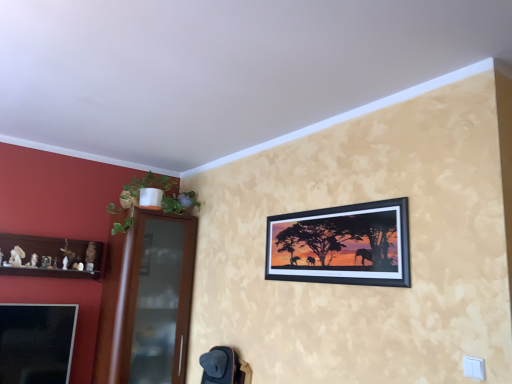
What do you see at coordinates (161, 194) in the screenshot? The width and height of the screenshot is (512, 384). I see `green leafy plant at left` at bounding box center [161, 194].

Where is `wooden shelf at left`? The width and height of the screenshot is (512, 384). wooden shelf at left is located at coordinates (50, 256).

Measure the distance between black matte picture frame at upper center and camera.

The depth of black matte picture frame at upper center is 6.35 feet.

Locate an element on the screen. green leafy plant at left is located at coordinates (161, 194).

Does green leafy plant at left have a lesser width compared to brown glass door at left?

Correct, the width of green leafy plant at left is less than that of brown glass door at left.

Considering the positions of objects green leafy plant at left and brown glass door at left in the image provided, who is more to the left, green leafy plant at left or brown glass door at left?

brown glass door at left.

In terms of size, does green leafy plant at left appear bigger or smaller than brown glass door at left?

green leafy plant at left is smaller than brown glass door at left.

Which is in front, point (168, 207) or point (178, 276)?

Point (168, 207)

Who is bigger, wooden shelf at left or black matte picture frame at upper center?

wooden shelf at left.

Considering the positions of objects wooden shelf at left and black matte picture frame at upper center in the image provided, who is in front, wooden shelf at left or black matte picture frame at upper center?

black matte picture frame at upper center is closer to the camera.

Does wooden shelf at left turn towards black matte picture frame at upper center?

Yes, wooden shelf at left faces towards black matte picture frame at upper center.

Does brown glass door at left turn towards wooden shelf at left?

No, brown glass door at left is not facing towards wooden shelf at left.

Which object is thinner, brown glass door at left or wooden shelf at left?

With smaller width is wooden shelf at left.

Can we say brown glass door at left lies outside wooden shelf at left?

brown glass door at left lies outside wooden shelf at left's area.

Where is `picture frame in front of the wooden shelf at left`? This screenshot has height=384, width=512. picture frame in front of the wooden shelf at left is located at coordinates (x=342, y=245).

Is black matte picture frame at upper center at the left side of wooden shelf at left?

In fact, black matte picture frame at upper center is to the right of wooden shelf at left.

Would you consider black matte picture frame at upper center to be distant from wooden shelf at left?

Indeed, black matte picture frame at upper center is not near wooden shelf at left.

Is black matte picture frame at upper center turned away from wooden shelf at left?

No, wooden shelf at left is not at the back of black matte picture frame at upper center.

Which of these two, brown glass door at left or black matte picture frame at upper center, stands shorter?

Standing shorter between the two is black matte picture frame at upper center.

Does point (151, 322) appear closer or farther from the camera than point (396, 279)?

Point (151, 322) is positioned farther from the camera compared to point (396, 279).

Is brown glass door at left next to black matte picture frame at upper center and touching it?

They are not placed beside each other.

Is brown glass door at left aimed at black matte picture frame at upper center?

Yes.

In the scene shown: Considering the sizes of objects black matte picture frame at upper center and green leafy plant at left in the image provided, who is smaller, black matte picture frame at upper center or green leafy plant at left?

Smaller between the two is black matte picture frame at upper center.

Is black matte picture frame at upper center looking in the opposite direction of green leafy plant at left?

No.

Where is `picture frame on the right of green leafy plant at left`? The image size is (512, 384). picture frame on the right of green leafy plant at left is located at coordinates [342, 245].

Relative to green leafy plant at left, is black matte picture frame at upper center in front or behind?

In the image, black matte picture frame at upper center appears in front of green leafy plant at left.

Is wooden shelf at left closer to camera compared to brown glass door at left?

Yes, wooden shelf at left is closer to the camera.

Considering the sizes of objects wooden shelf at left and brown glass door at left in the image provided, who is bigger, wooden shelf at left or brown glass door at left?

Bigger between the two is brown glass door at left.

From the image's perspective, is wooden shelf at left on top of brown glass door at left?

Indeed, from the image's perspective, wooden shelf at left is shown above brown glass door at left.

Is wooden shelf at left to the left of brown glass door at left from the viewer's perspective?

Correct, you'll find wooden shelf at left to the left of brown glass door at left.

Where is `plant located above the brown glass door at left (from the image's perspective)`? plant located above the brown glass door at left (from the image's perspective) is located at coordinates (161, 194).

Find the location of a particular element. The image size is (512, 384). shelf directly beneath the black matte picture frame at upper center (from a real-world perspective) is located at coordinates (50, 256).

Considering their positions, is wooden shelf at left positioned further to green leafy plant at left than brown glass door at left?

Among the two, wooden shelf at left is located further to green leafy plant at left.

Based on their spatial positions, is green leafy plant at left or wooden shelf at left closer to black matte picture frame at upper center?

green leafy plant at left lies closer to black matte picture frame at upper center than the other object.

Looking at the image, which one is located further to wooden shelf at left, brown glass door at left or black matte picture frame at upper center?

The object further to wooden shelf at left is black matte picture frame at upper center.

Looking at the image, which one is located closer to brown glass door at left, wooden shelf at left or green leafy plant at left?

Based on the image, green leafy plant at left appears to be nearer to brown glass door at left.

Looking at this image, considering their positions, is brown glass door at left positioned further to black matte picture frame at upper center than wooden shelf at left?

The object further to black matte picture frame at upper center is wooden shelf at left.

In the scene shown: When comparing their distances from green leafy plant at left, does black matte picture frame at upper center or brown glass door at left seem closer?

The object closer to green leafy plant at left is brown glass door at left.

Looking at the image, which one is located closer to brown glass door at left, wooden shelf at left or black matte picture frame at upper center?

The object closer to brown glass door at left is wooden shelf at left.

Estimate the real-world distances between objects in this image. Which object is further from brown glass door at left, green leafy plant at left or wooden shelf at left?

Among the two, wooden shelf at left is located further to brown glass door at left.

Locate an element on the screen. Image resolution: width=512 pixels, height=384 pixels. plant between wooden shelf at left and black matte picture frame at upper center is located at coordinates (161, 194).

The height and width of the screenshot is (384, 512). Identify the location of glass door between wooden shelf at left and black matte picture frame at upper center from left to right. (157, 302).

You are a GUI agent. You are given a task and a screenshot of the screen. Output one action in this format:
    pyautogui.click(x=<x>, y=<y>)
    Task: Click on the plant between brown glass door at left and black matte picture frame at upper center
    The image size is (512, 384).
    Given the screenshot: What is the action you would take?
    pos(161,194)

The image size is (512, 384). I want to click on shelf between green leafy plant at left and brown glass door at left in the vertical direction, so click(50, 256).